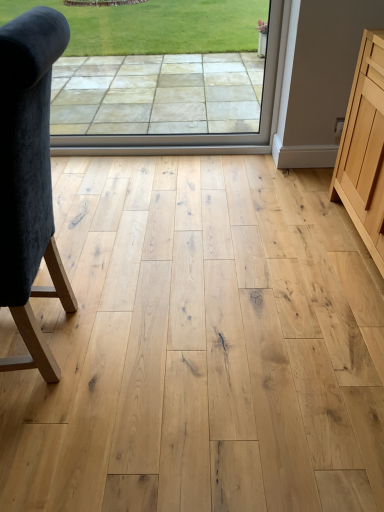
At what (x,y) coordinates should I click in order to perform the action: click on vacant location behind velvet dark blue chair at left. Please return your answer as a coordinate pair (x, y). Looking at the image, I should click on (105, 268).